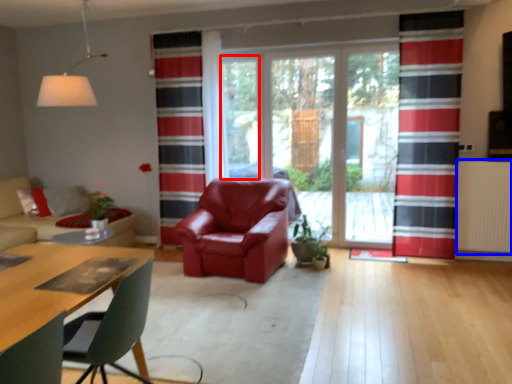
Question: Which object appears closest to the camera in this image, window screen (highlighted by a red box) or radiator (highlighted by a blue box)?

Choices:
 (A) window screen
 (B) radiator

Answer: (B)